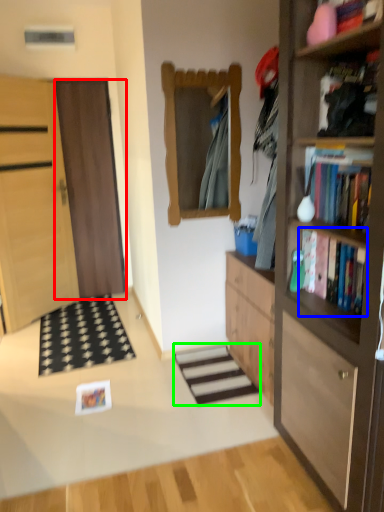
Question: Based on their relative distances, which object is farther from door (highlighted by a red box)? Choose from book (highlighted by a blue box) and stairwell (highlighted by a green box).

Choices:
 (A) book
 (B) stairwell

Answer: (A)